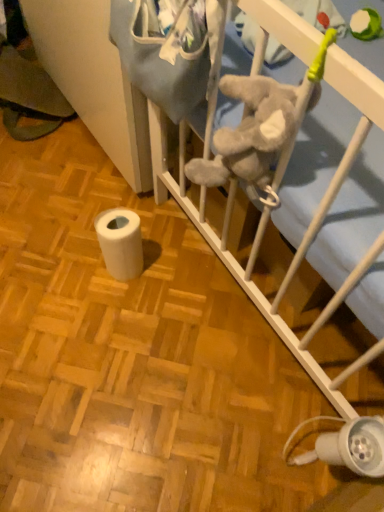
Where is `free spot to the left of white matte toilet paper at lower left`? The image size is (384, 512). free spot to the left of white matte toilet paper at lower left is located at coordinates (66, 267).